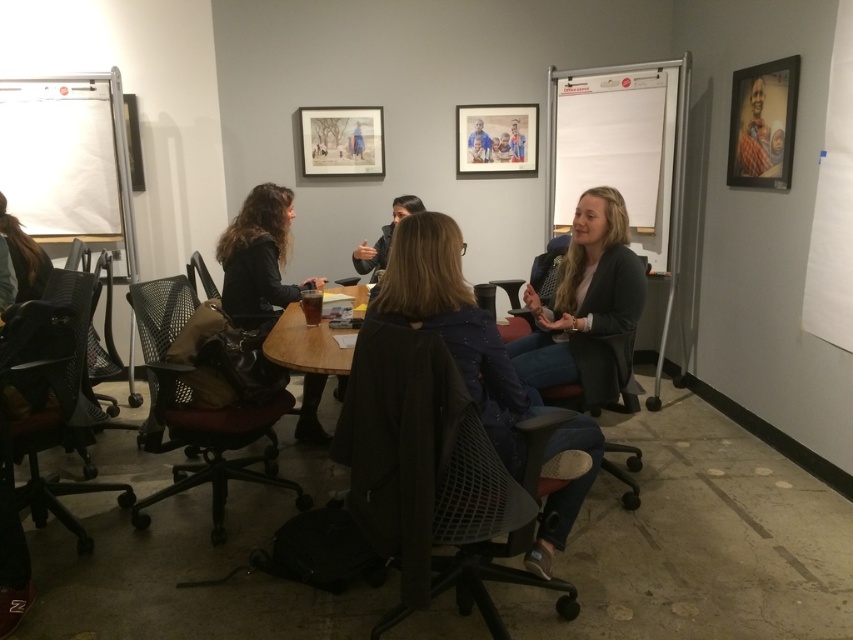
Between point (621, 276) and point (28, 275), which one is positioned in front?

Positioned in front is point (621, 276).

Can you confirm if matte black blazer at center is shorter than dark brown hair at left?

Incorrect, matte black blazer at center's height does not fall short of dark brown hair at left's.

Between point (589, 294) and point (28, 296), which one is positioned in front?

Point (589, 294)

This screenshot has width=853, height=640. I want to click on matte black blazer at center, so click(585, 305).

How distant is matte black jacket at left from matte black chair at center?

They are 3.94 feet apart.

Does point (277, 266) lie in front of point (529, 324)?

No, it is not.

Is point (283, 250) positioned behind point (519, 328)?

Yes, it is behind point (519, 328).

You are a GUI agent. You are given a task and a screenshot of the screen. Output one action in this format:
    pyautogui.click(x=<x>, y=<y>)
    Task: Click on the matte black jacket at left
    Image resolution: width=853 pixels, height=640 pixels.
    Given the screenshot: What is the action you would take?
    pyautogui.click(x=259, y=259)

Which of these two, matte black blazer at center or black mesh office chair at center, stands shorter?

black mesh office chair at center

Can you confirm if matte black blazer at center is positioned above black mesh office chair at center?

Correct, matte black blazer at center is located above black mesh office chair at center.

Does point (560, 381) come in front of point (618, 445)?

That is True.

The height and width of the screenshot is (640, 853). I want to click on matte black blazer at center, so (x=585, y=305).